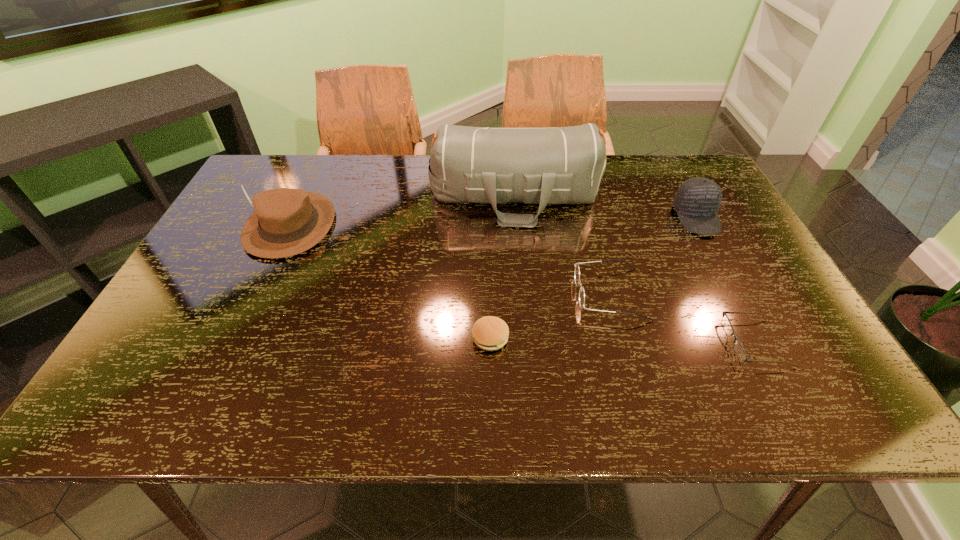
The height and width of the screenshot is (540, 960). Identify the location of fedora situated at the far edge. (285, 222).

This screenshot has width=960, height=540. In order to click on object present at the left edge in this screenshot , I will do `click(285, 222)`.

Identify the location of baseball cap that is at the right edge. This screenshot has height=540, width=960. [x=697, y=201].

Find the location of a particular element. This screenshot has width=960, height=540. spectacles that is positioned at the right edge is located at coordinates (739, 350).

The height and width of the screenshot is (540, 960). I want to click on object located in the far left corner section of the desktop, so click(x=285, y=222).

In the image, there is a desktop. Where is `vacant area at the far edge`? vacant area at the far edge is located at coordinates (607, 192).

In the image, there is a desktop. Identify the location of vacant space at the near edge. This screenshot has width=960, height=540. coord(434,404).

You are a GUI agent. You are given a task and a screenshot of the screen. Output one action in this format:
    pyautogui.click(x=<x>, y=<y>)
    Task: Click on the vacant space at the left edge
    
    Given the screenshot: What is the action you would take?
    pyautogui.click(x=199, y=280)

Locate an element on the screen. This screenshot has width=960, height=540. vacant space at the right edge of the desktop is located at coordinates (816, 361).

Locate an element on the screen. Image resolution: width=960 pixels, height=540 pixels. free spot at the near left corner of the desktop is located at coordinates (153, 384).